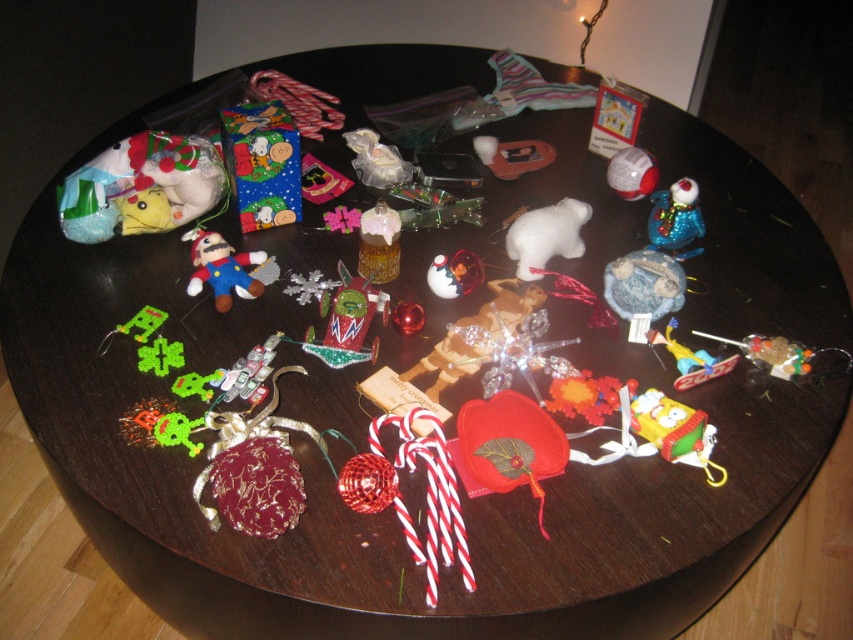
Question: Can you confirm if velvet plush mario at center is positioned to the left of shiny blue ornament at upper right?

Choices:
 (A) yes
 (B) no

Answer: (A)

Question: Is white felt bear at center above velvet plush mario at center?

Choices:
 (A) yes
 (B) no

Answer: (A)

Question: In this image, where is shiny metallic car at center located relative to white felt bear at center?

Choices:
 (A) left
 (B) right

Answer: (A)

Question: Which object is positioned closest to the white felt bear at center?

Choices:
 (A) shiny blue ornament at upper right
 (B) yellow fabric sponge at lower right
 (C) velvet plush mario at center
 (D) shiny metallic car at center

Answer: (A)

Question: Which point appears farthest from the camera in this image?

Choices:
 (A) click(x=705, y=456)
 (B) click(x=675, y=182)

Answer: (B)

Question: Which of the following is the farthest from the observer?

Choices:
 (A) (225, 272)
 (B) (671, 456)
 (C) (344, 307)

Answer: (A)